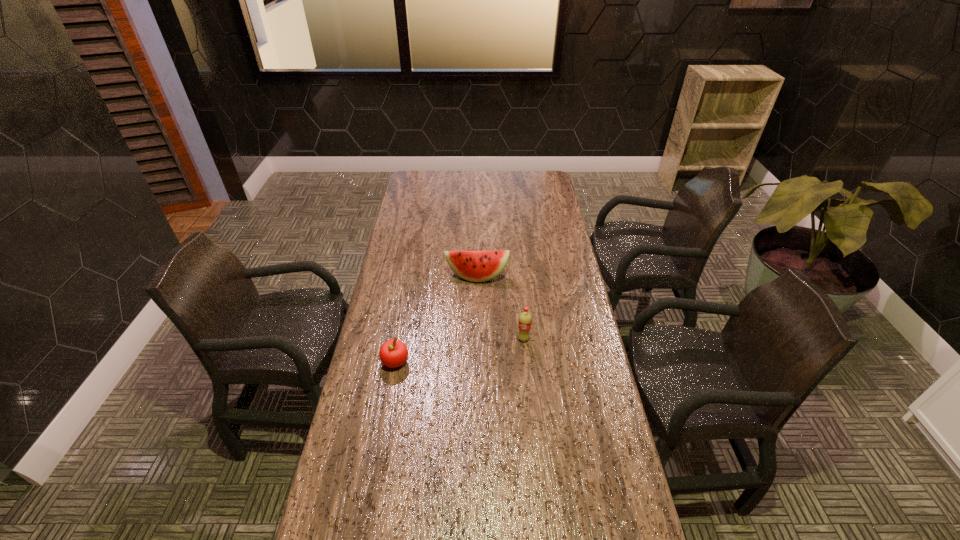
This screenshot has height=540, width=960. I want to click on free point at the far edge, so click(464, 178).

Where is `free region at the left edge of the desktop`? This screenshot has height=540, width=960. free region at the left edge of the desktop is located at coordinates (355, 447).

Where is `free region at the right edge of the desktop`? The width and height of the screenshot is (960, 540). free region at the right edge of the desktop is located at coordinates (571, 344).

Where is `free region at the far left corner`? The width and height of the screenshot is (960, 540). free region at the far left corner is located at coordinates (433, 176).

Locate an element on the screen. The image size is (960, 540). free region at the far right corner of the desktop is located at coordinates [524, 184].

Identify the location of vacant area between the nearest object and the second farthest object. (460, 350).

Locate an element on the screen. This screenshot has width=960, height=540. free spot between the rightmost object and the shortest object is located at coordinates (460, 350).

You are a GUI agent. You are given a task and a screenshot of the screen. Output one action in this format:
    pyautogui.click(x=<x>, y=<y>)
    Task: Click on the free area in between the apple and the soda
    The height and width of the screenshot is (540, 960).
    Given the screenshot: What is the action you would take?
    pyautogui.click(x=460, y=350)

This screenshot has width=960, height=540. What are the coordinates of `vacant space that is in between the shortest object and the rightmost object` in the screenshot? It's located at click(460, 350).

Locate which object ranks in proximity to the rightmost object. Please provide its 2D coordinates. Your answer should be formatted as a tuple, i.e. [(x, y)], where the tuple contains the x and y coordinates of a point satisfying the conditions above.

[(476, 266)]